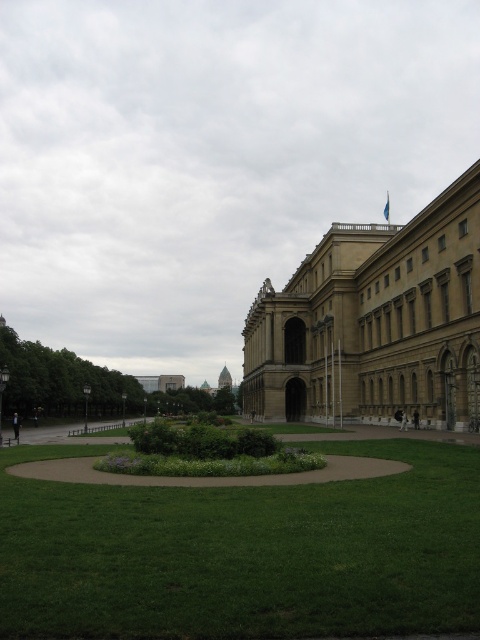
You are standing in the plaza looking at the green grass at center and the brown stone building at center. Which object is nearer to you?

The green grass at center is closer to the viewer than the brown stone building at center.

You are planning to plant a new tree in the plaza. The tree requires a space of 10 square meters. Given the green grass at center and the brown stone building at center, which area would be suitable for planting the tree?

The brown stone building at center occupies a larger area than the green grass at center, so the green grass at center is too small to accommodate the tree. You should choose the area around the brown stone building at center for planting the tree.